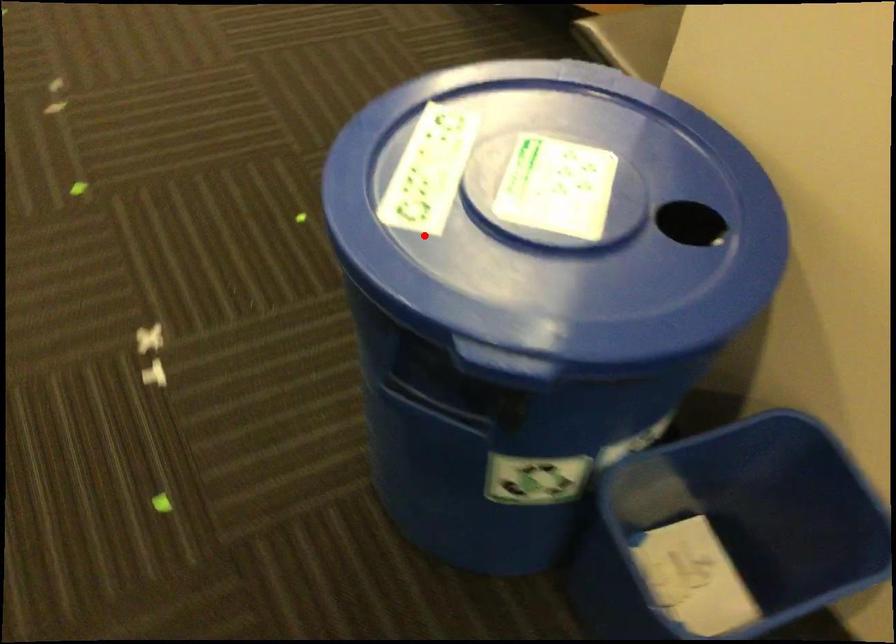
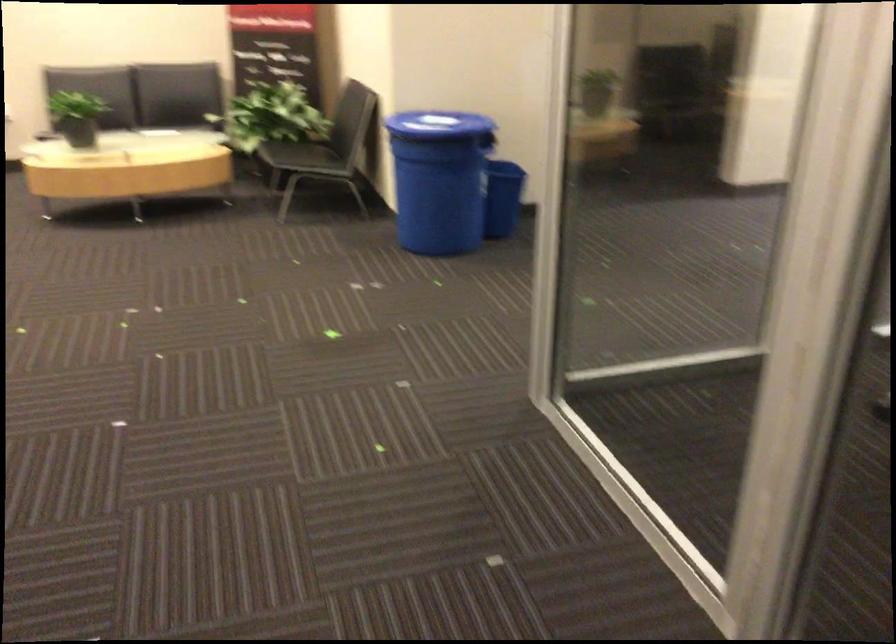
Locate, in the second image, the point that corresponds to the highlighted location in the first image.

(438, 124)